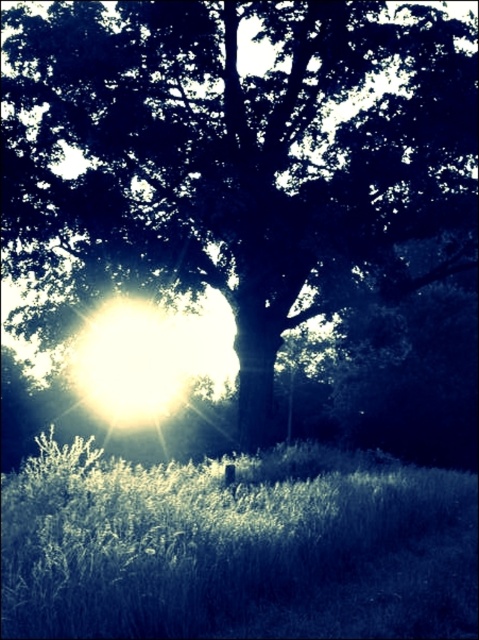
You are standing at the point marked as point (235, 157) in the image. Looking around, you see a green leafy tree at center. What is the nearest object to you?

The nearest object to you at point (235, 157) is the green leafy tree at center, as it is located at that exact point.

You are a photographer trying to capture the tree and grass in the scene. Which object, the green leafy tree at center or the green grass at lower center, has a narrower width?

The green leafy tree at center is thinner than green grass at lower center, so the green leafy tree at center has a narrower width.